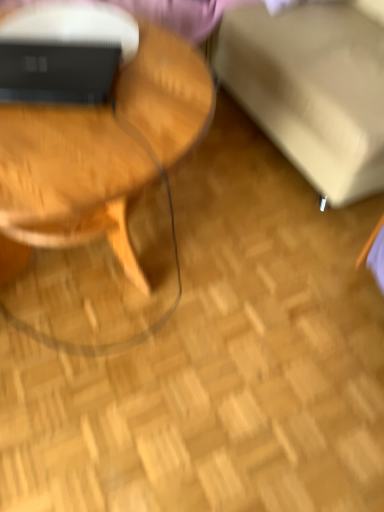
Locate an element on the screen. Image resolution: width=384 pixels, height=512 pixels. free spot in front of matte black laptop at upper left is located at coordinates (52, 147).